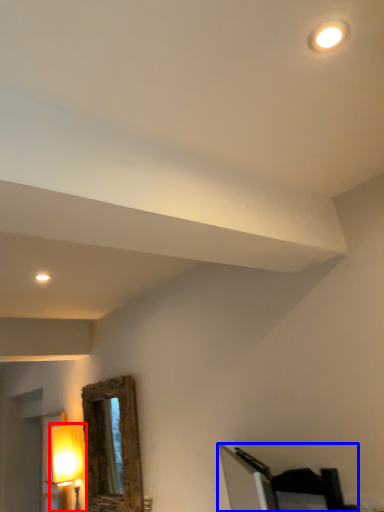
Question: Which object is closer to the camera taking this photo, lamp (highlighted by a red box) or furniture (highlighted by a blue box)?

Choices:
 (A) lamp
 (B) furniture

Answer: (B)